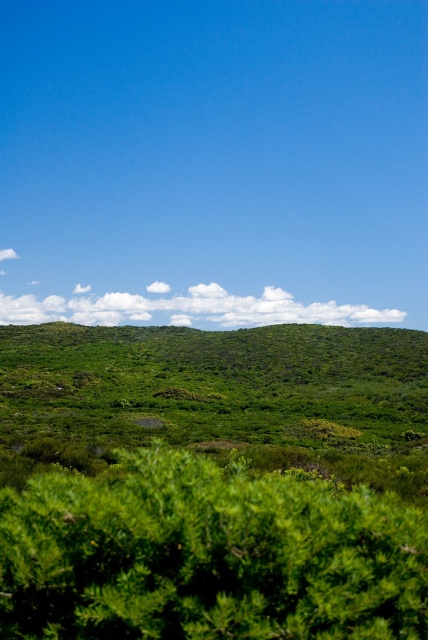
Question: Which point is closer to the camera?

Choices:
 (A) white fluffy cloud at center
 (B) green leafy bush at center

Answer: (B)

Question: In this image, where is green leafy bush at center located relative to white fluffy cloud at center?

Choices:
 (A) above
 (B) below

Answer: (B)

Question: Considering the real-world distances, which object is closest to the green leafy bush at center?

Choices:
 (A) white fluffy cloud at center
 (B) green leafy hillside at center

Answer: (B)

Question: Where is green leafy bush at center located in relation to white fluffy cloud at center in the image?

Choices:
 (A) right
 (B) left

Answer: (A)

Question: Which of the following is the farthest from the observer?

Choices:
 (A) green leafy bush at center
 (B) green leafy hillside at center
 (C) white fluffy cloud at center

Answer: (C)

Question: Can you confirm if green leafy bush at center is bigger than green leafy hillside at center?

Choices:
 (A) yes
 (B) no

Answer: (B)